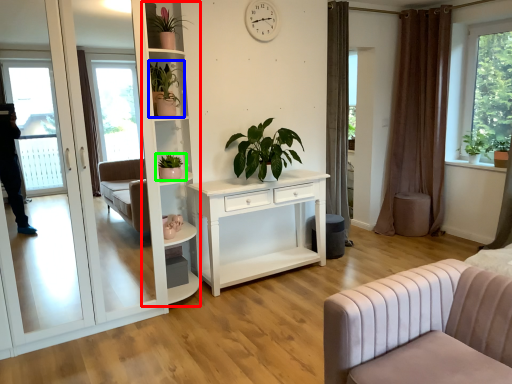
Question: Considering the real-world distances, which object is farthest from bookshelf (highlighted by a red box)? houseplant (highlighted by a blue box) or houseplant (highlighted by a green box)?

Choices:
 (A) houseplant
 (B) houseplant

Answer: (B)